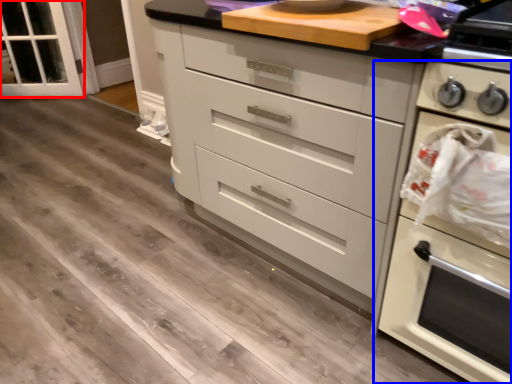
Question: Among these objects, which one is farthest to the camera, glass door (highlighted by a red box) or home appliance (highlighted by a blue box)?

Choices:
 (A) glass door
 (B) home appliance

Answer: (A)